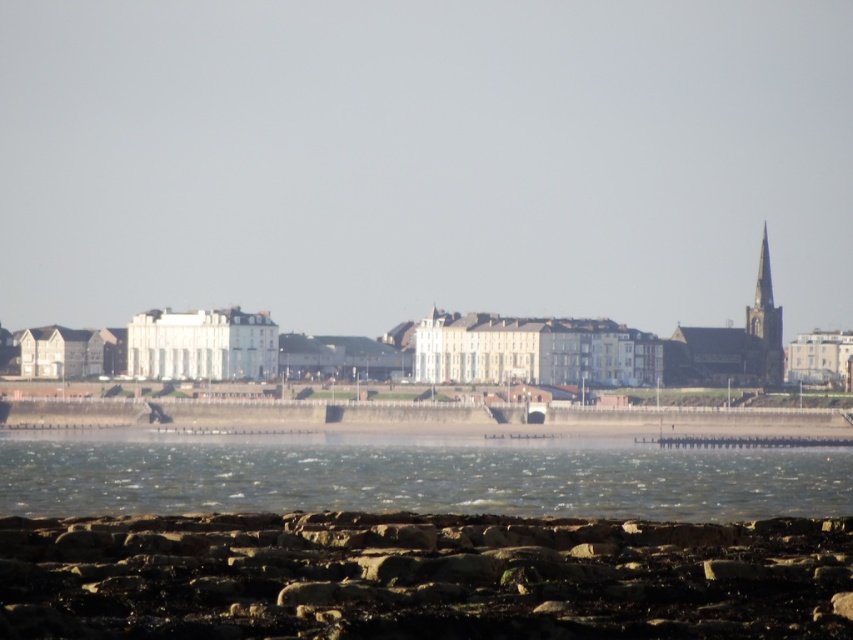
Question: Which object is positioned closest to the dark gray stone spire at right?

Choices:
 (A) rusty stone rocks at lower center
 (B) clear water at lower center

Answer: (B)

Question: Can you confirm if clear water at lower center is bigger than dark gray stone spire at right?

Choices:
 (A) no
 (B) yes

Answer: (B)

Question: Estimate the real-world distances between objects in this image. Which object is farther from the clear water at lower center?

Choices:
 (A) rusty stone rocks at lower center
 (B) dark gray stone spire at right

Answer: (A)

Question: Is rusty stone rocks at lower center behind clear water at lower center?

Choices:
 (A) yes
 (B) no

Answer: (B)

Question: Which point appears closest to the camera in this image?

Choices:
 (A) (757, 291)
 (B) (763, 564)

Answer: (B)

Question: Does rusty stone rocks at lower center have a larger size compared to dark gray stone spire at right?

Choices:
 (A) yes
 (B) no

Answer: (A)